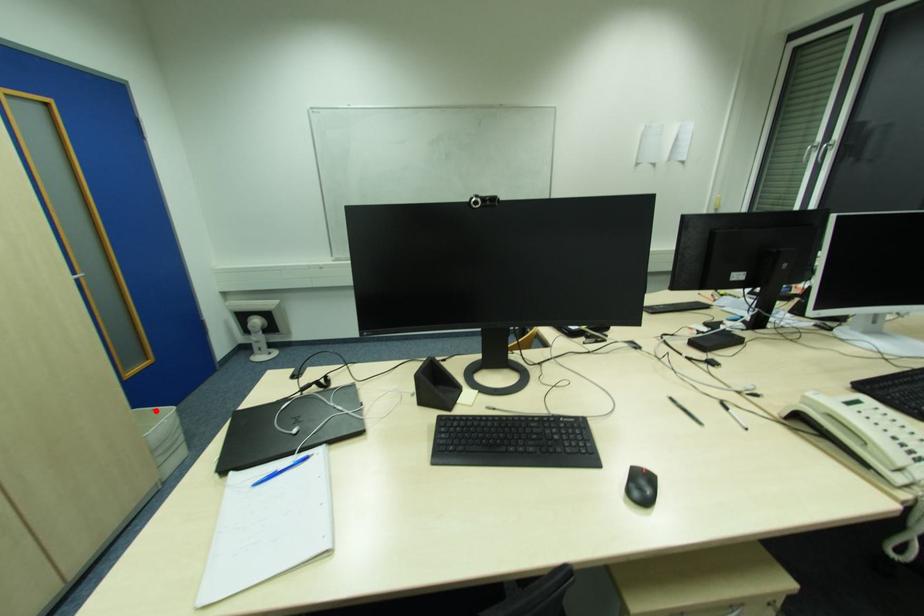
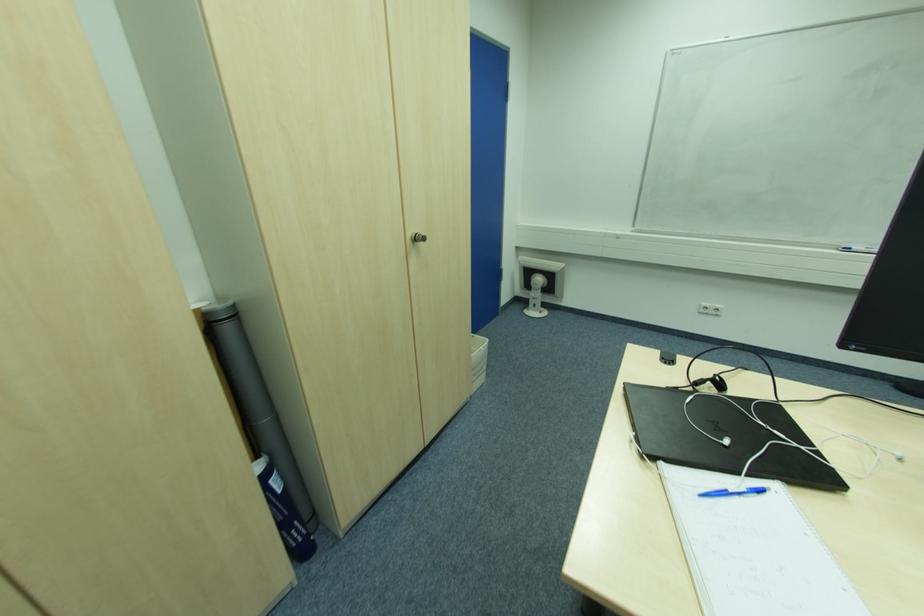
Where in the second image is the point corresponding to the highlighted location from the first image?

(475, 338)